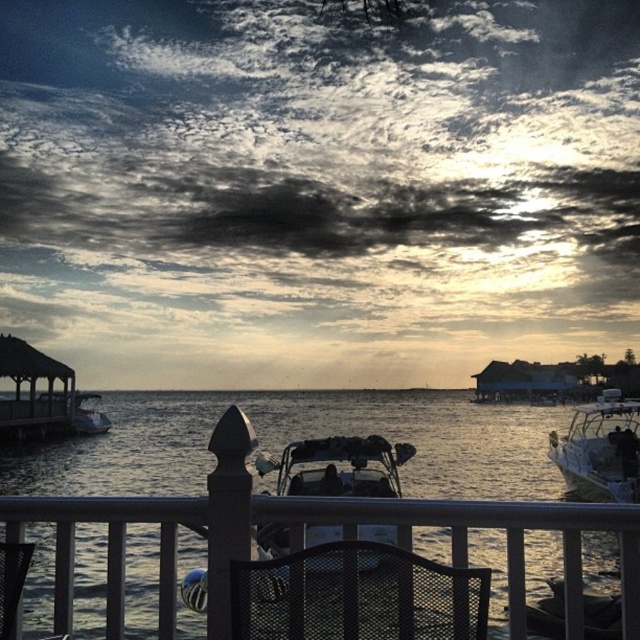
How much distance is there between shiny black motorboat at center and white glossy boat at right?

shiny black motorboat at center and white glossy boat at right are 25.40 feet apart from each other.

Who is more forward, (275, 528) or (580, 406)?

Point (275, 528) is in front.

Who is more forward, (358, 536) or (616, 496)?

Point (358, 536) is more forward.

Locate an element on the screen. This screenshot has width=640, height=640. shiny black motorboat at center is located at coordinates (337, 467).

Which of these two, white glossy boat at right or metallic silver boat at center, stands taller?

white glossy boat at right is taller.

Is white glossy boat at right taller than metallic silver boat at center?

Yes.

Image resolution: width=640 pixels, height=640 pixels. What do you see at coordinates (600, 449) in the screenshot?
I see `white glossy boat at right` at bounding box center [600, 449].

The height and width of the screenshot is (640, 640). I want to click on white glossy boat at right, so click(x=600, y=449).

Does shiny black motorboat at center appear under black mesh chair at lower center?

Yes.

Which is more to the left, shiny black motorboat at center or black mesh chair at lower center?

black mesh chair at lower center is more to the left.

Who is more forward, [330,467] or [8,580]?

Positioned in front is point [8,580].

Where is `shiny black motorboat at center`? The height and width of the screenshot is (640, 640). shiny black motorboat at center is located at coordinates (337, 467).